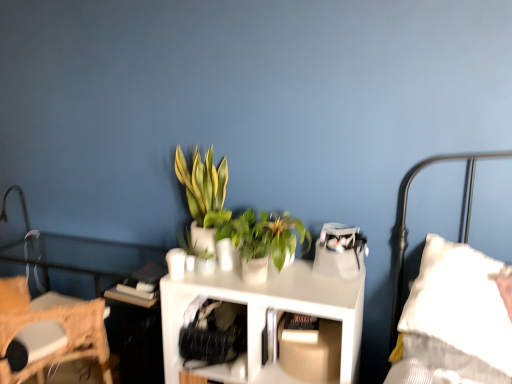
Question: Which is correct: green matte plant at center, which ranks as the second houseplant in left-to-right order, is inside green leafy plant at center, arranged as the 2th houseplant when viewed from the right, or outside of it?

Choices:
 (A) inside
 (B) outside

Answer: (B)

Question: In the image, is green matte plant at center, which is counted as the 1th houseplant, starting from the right, positioned in front of or behind green leafy plant at center, which appears as the first houseplant when viewed from the left?

Choices:
 (A) behind
 (B) front

Answer: (B)

Question: Which of these objects is positioned closest to the woven straw chair at left?

Choices:
 (A) metallic silver table lamp at left
 (B) green matte plant at center, which ranks as the second houseplant in left-to-right order
 (C) white matte table at center
 (D) green leafy plant at center, which appears as the first houseplant when viewed from the left

Answer: (C)

Question: Estimate the real-world distances between objects in this image. Which object is farther from the woven straw chair at left?

Choices:
 (A) green leafy plant at center, which appears as the first houseplant when viewed from the left
 (B) metallic silver table lamp at left
 (C) green matte plant at center, which ranks as the second houseplant in left-to-right order
 (D) white matte table at center

Answer: (C)